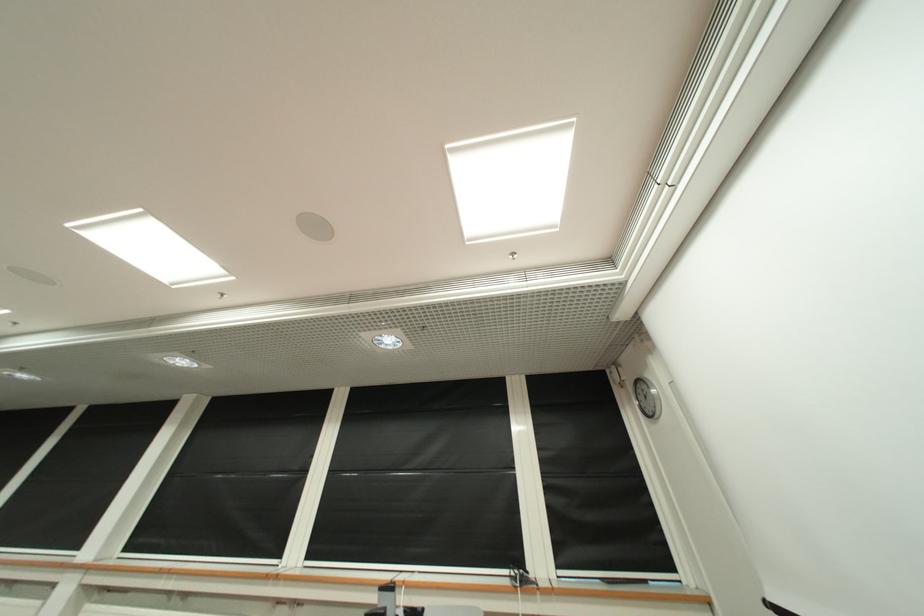
Find where to lift the round wall clock. Please return your answer as a coordinate pair (x, y).

(647, 398)